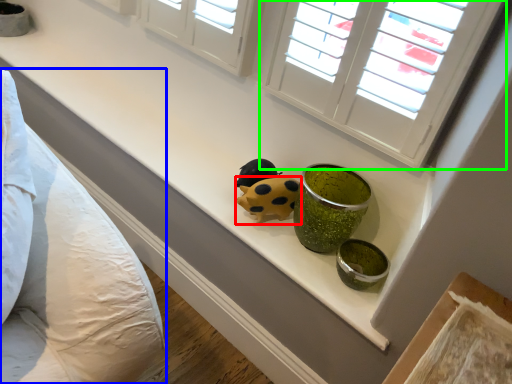
Question: Based on their relative distances, which object is nearer to ladybug (highlighted by a red box)? Choose from bedding (highlighted by a blue box) and window (highlighted by a green box).

Choices:
 (A) bedding
 (B) window

Answer: (B)